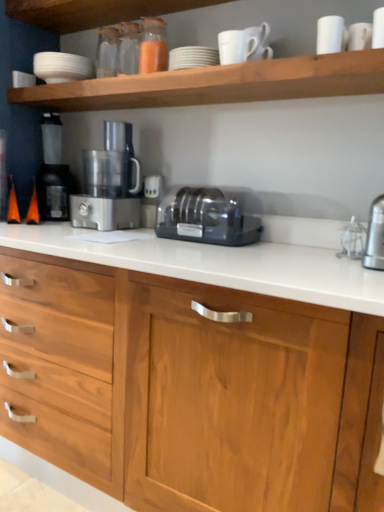
Question: From the image's perspective, is white matte cup at upper right, marked as the 1th tableware in a bottom-to-top arrangement, below black plastic toaster at center?

Choices:
 (A) yes
 (B) no

Answer: (B)

Question: Does white matte cup at upper right, marked as the 1th tableware in a bottom-to-top arrangement, have a larger size compared to black plastic toaster at center?

Choices:
 (A) yes
 (B) no

Answer: (B)

Question: From a real-world perspective, is white matte cup at upper right, the 1th tableware positioned from the right, on black plastic toaster at center?

Choices:
 (A) no
 (B) yes

Answer: (B)

Question: Is black plastic toaster at center a part of white matte cup at upper right, which is the 2th tableware in left-to-right order?

Choices:
 (A) yes
 (B) no

Answer: (B)

Question: From the image's perspective, is white matte cup at upper right, marked as the 1th tableware in a bottom-to-top arrangement, located above black plastic toaster at center?

Choices:
 (A) yes
 (B) no

Answer: (A)

Question: Is point tap(167, 232) closer or farther from the camera than point tap(221, 98)?

Choices:
 (A) closer
 (B) farther

Answer: (B)

Question: From the image's perspective, relative to white matte shelf at upper center, is black plastic toaster at center above or below?

Choices:
 (A) above
 (B) below

Answer: (B)

Question: From their relative heights in the image, would you say black plastic toaster at center is taller or shorter than white matte shelf at upper center?

Choices:
 (A) tall
 (B) short

Answer: (A)

Question: Based on their positions, is black plastic toaster at center located to the left or right of white matte shelf at upper center?

Choices:
 (A) left
 (B) right

Answer: (B)

Question: Choose the correct answer: Is black plastic toaster at center inside black plastic coffee machine at left or outside it?

Choices:
 (A) outside
 (B) inside

Answer: (A)

Question: From their relative heights in the image, would you say black plastic toaster at center is taller or shorter than black plastic coffee machine at left?

Choices:
 (A) tall
 (B) short

Answer: (B)

Question: From the image's perspective, is black plastic toaster at center positioned above or below black plastic coffee machine at left?

Choices:
 (A) below
 (B) above

Answer: (A)

Question: From a real-world perspective, is black plastic toaster at center above or below black plastic coffee machine at left?

Choices:
 (A) below
 (B) above

Answer: (A)

Question: From the image's perspective, is white matte shelf at upper center above or below white matte cup at upper right, marked as the 1th tableware in a bottom-to-top arrangement?

Choices:
 (A) above
 (B) below

Answer: (B)

Question: Considering their positions, is white matte shelf at upper center located in front of or behind white matte cup at upper right, the second tableware positioned from the top?

Choices:
 (A) front
 (B) behind

Answer: (A)